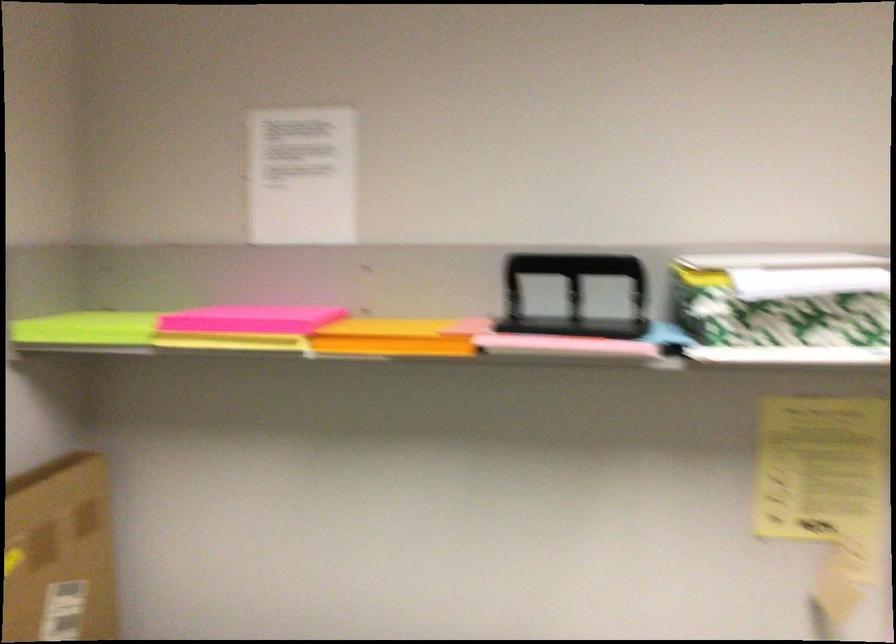
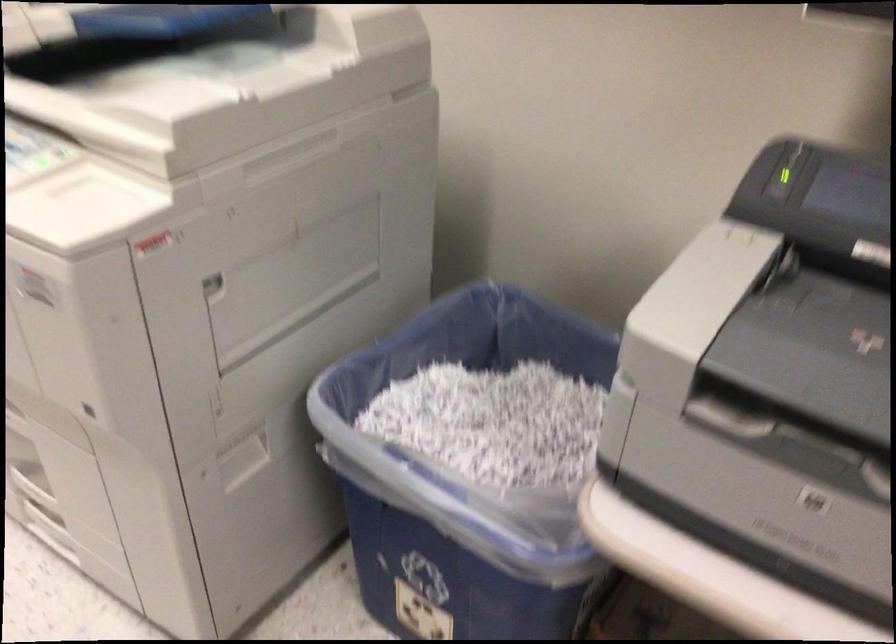
First-person continuous shooting, in which direction is the camera rotating?

The camera's rotation is toward right-down.